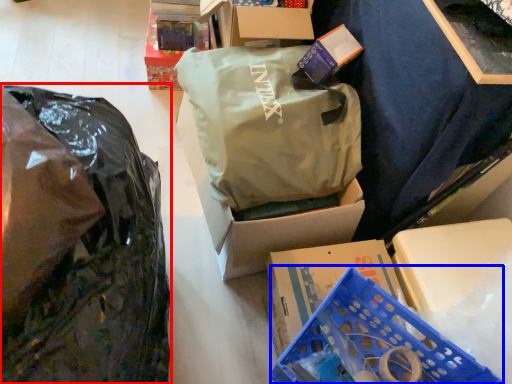
Question: Which of the following is the farthest to the observer, plastic bag (highlighted by a red box) or basket (highlighted by a blue box)?

Choices:
 (A) plastic bag
 (B) basket

Answer: (B)